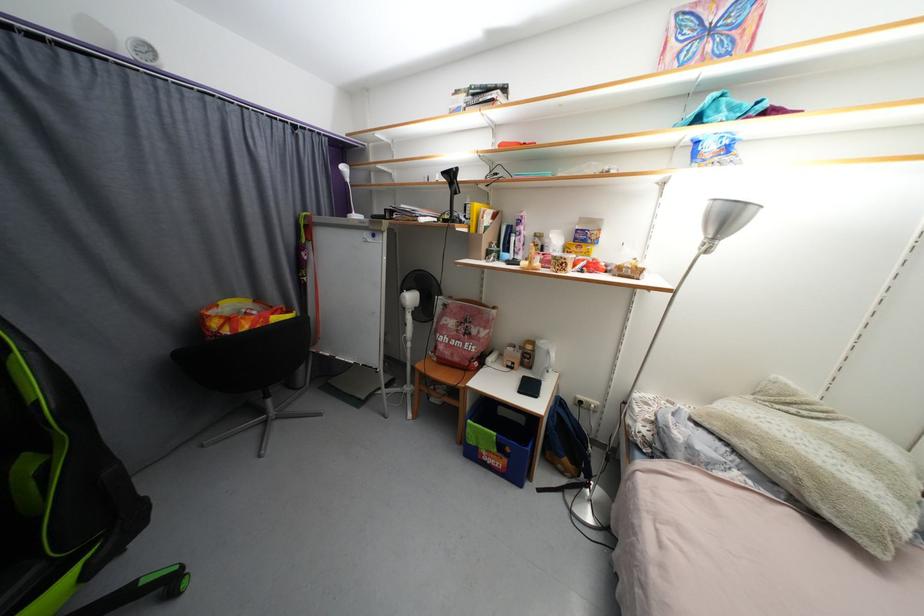
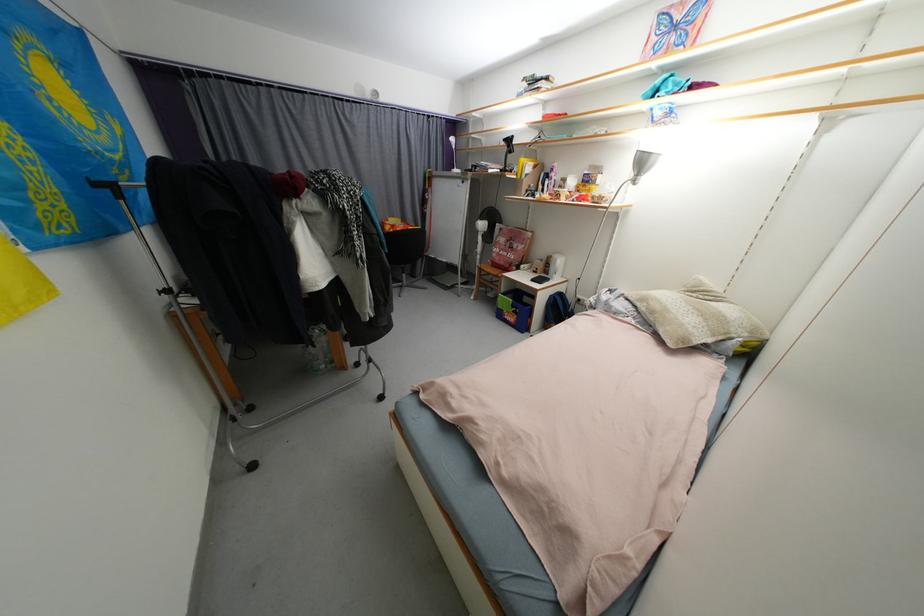
Locate, in the second image, the point that corresponds to point 480,333 in the first image.

(520, 248)